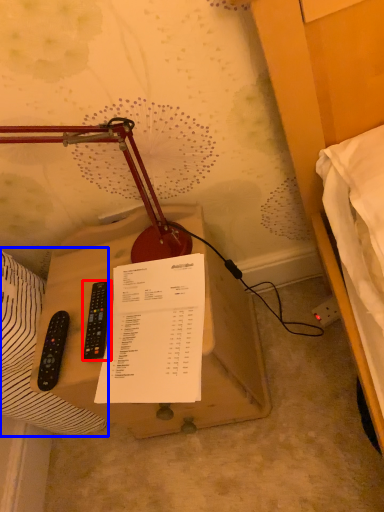
Question: Which object is closer to the camera taking this photo, remote control (highlighted by a red box) or sheet (highlighted by a blue box)?

Choices:
 (A) remote control
 (B) sheet

Answer: (B)